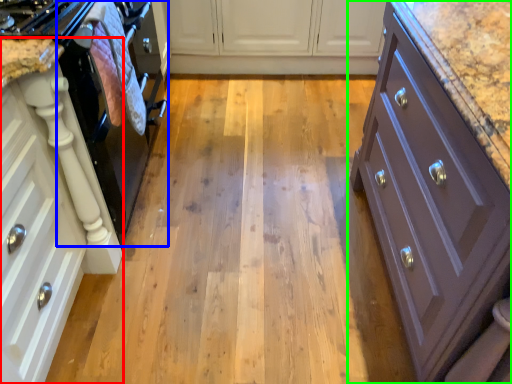
Question: Estimate the real-world distances between objects in this image. Which object is closer to cabinetry (highlighted by a red box), oven (highlighted by a blue box) or cabinetry (highlighted by a green box)?

Choices:
 (A) oven
 (B) cabinetry

Answer: (A)